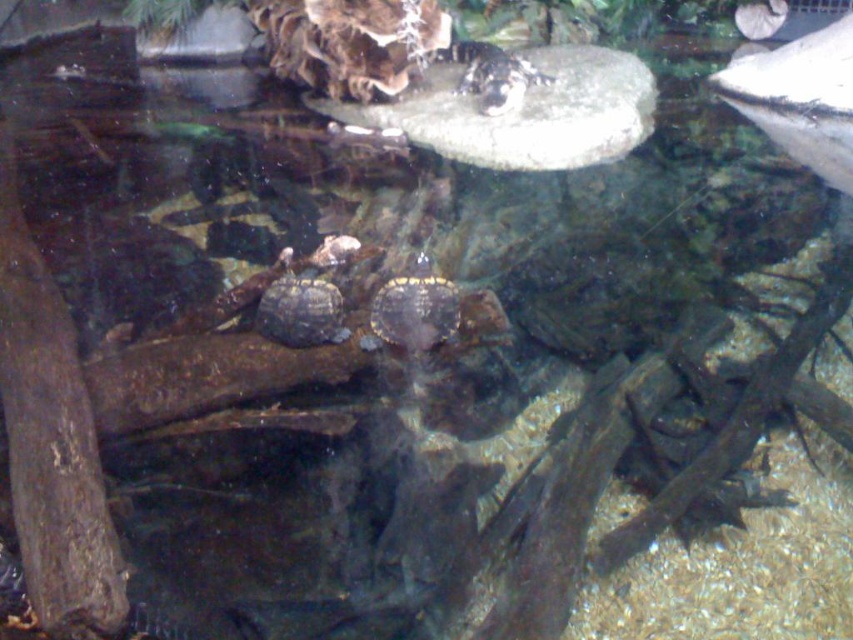
Question: Does shiny brown tortoise at center have a lesser width compared to brown matte tortoise at center?

Choices:
 (A) no
 (B) yes

Answer: (B)

Question: Is brown matte tortoise at center behind brown textured shell at upper center?

Choices:
 (A) yes
 (B) no

Answer: (B)

Question: Which of the following is the farthest from the observer?

Choices:
 (A) pos(515,65)
 (B) pos(282,291)
 (C) pos(376,320)

Answer: (A)

Question: Which object is the farthest from the shiny brown tortoise at center?

Choices:
 (A) brown matte tortoise at center
 (B) brown textured shell at upper center

Answer: (B)

Question: Is shiny brown tortoise at center to the right of brown matte tortoise at center from the viewer's perspective?

Choices:
 (A) no
 (B) yes

Answer: (B)

Question: Which point is farther to the camera?

Choices:
 (A) (405, 294)
 (B) (277, 308)
 (C) (462, 49)

Answer: (C)